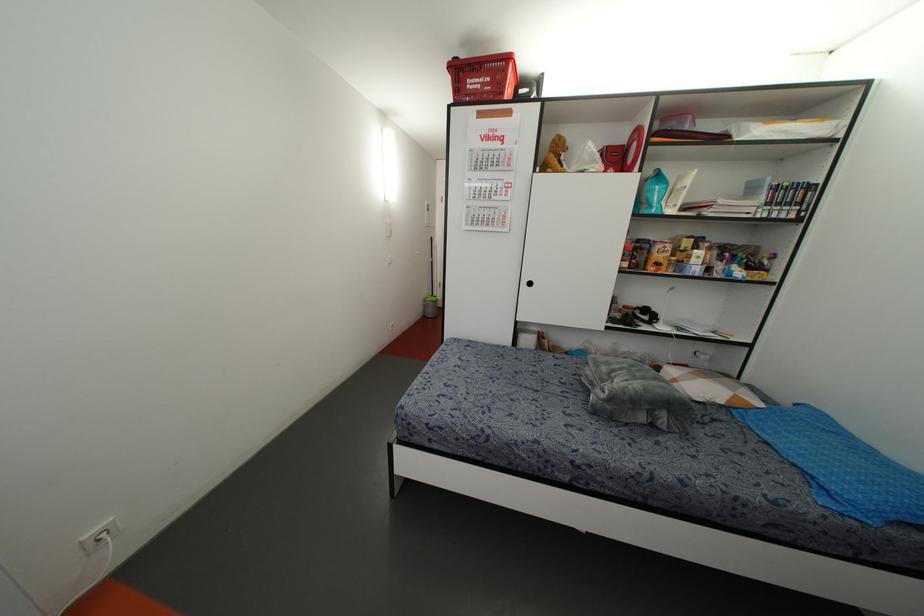
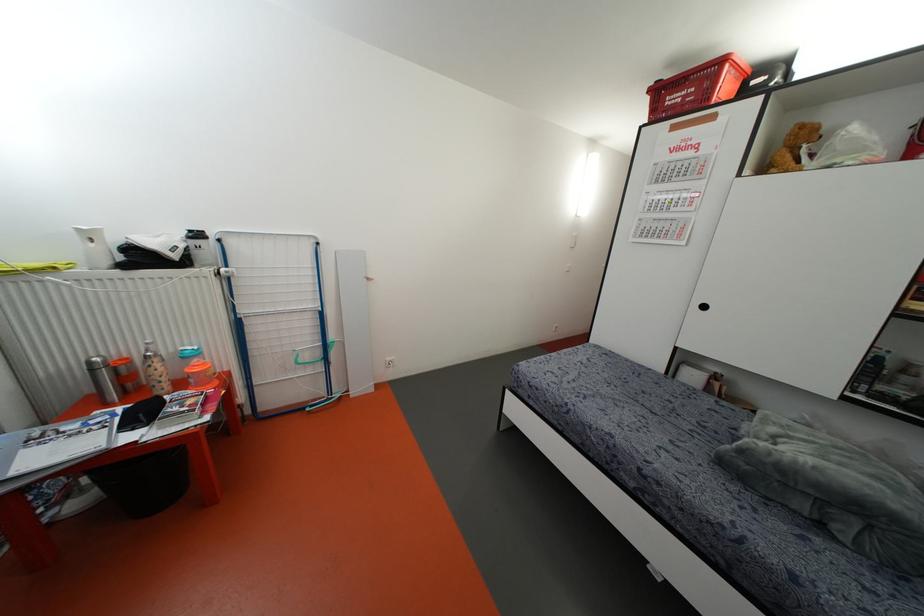
Find the pixel in the second image that matches [556,156] in the first image.

(796, 150)